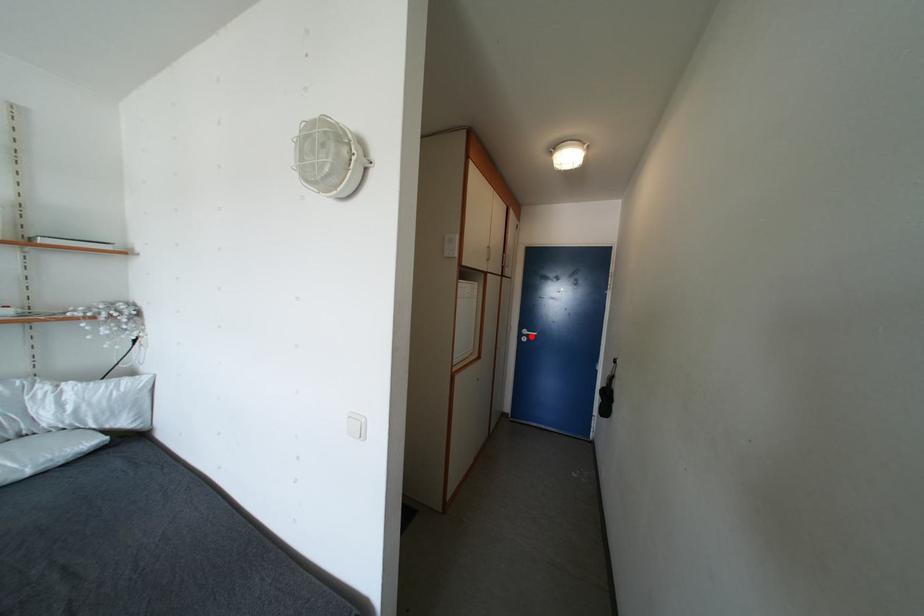
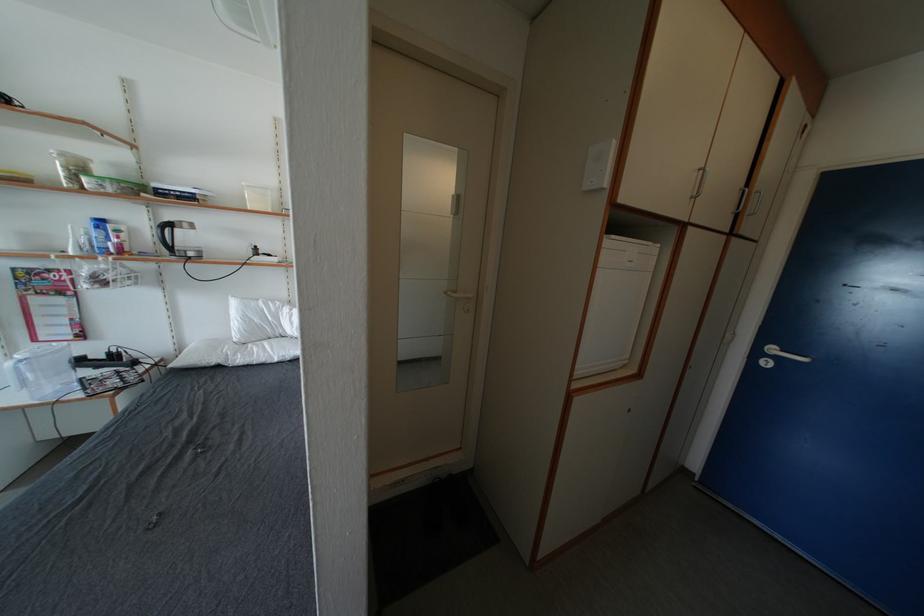
In the second image, find the point that corresponds to the highlighted location in the first image.

(779, 354)